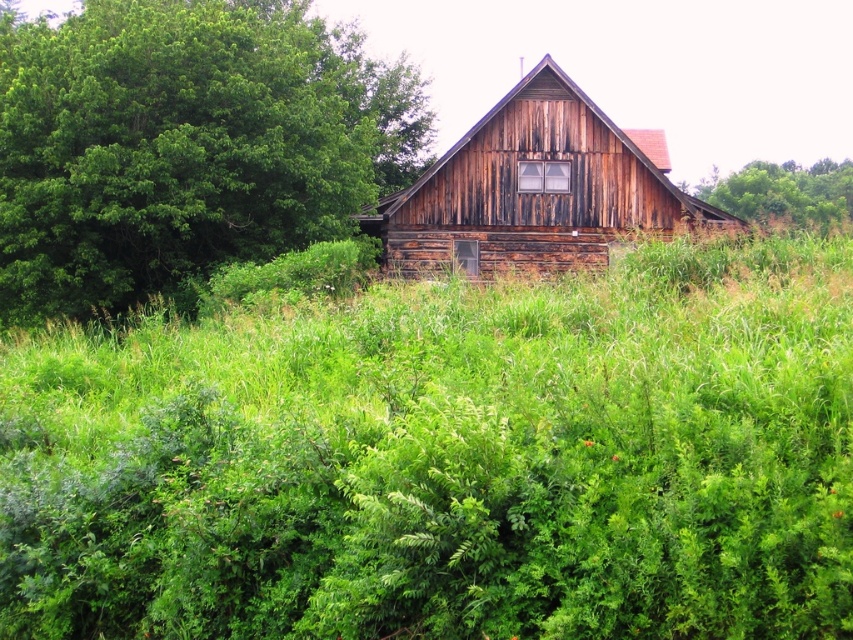
Question: Which point is closer to the camera?

Choices:
 (A) green leafy tree at upper right
 (B) green leafy tree at upper left

Answer: (B)

Question: Can you confirm if green leafy grass at center is wider than green leafy tree at upper right?

Choices:
 (A) yes
 (B) no

Answer: (B)

Question: Does green leafy grass at center have a greater width compared to green leafy tree at upper left?

Choices:
 (A) yes
 (B) no

Answer: (A)

Question: Considering the relative positions of green leafy grass at center and green leafy tree at upper right in the image provided, where is green leafy grass at center located with respect to green leafy tree at upper right?

Choices:
 (A) left
 (B) right

Answer: (A)

Question: Which of the following is the closest to the observer?

Choices:
 (A) green leafy tree at upper right
 (B) rustic wooden barn at center
 (C) green leafy tree at upper left

Answer: (B)

Question: Which is farther from the rustic wooden barn at center?

Choices:
 (A) green leafy tree at upper left
 (B) green leafy grass at center

Answer: (B)